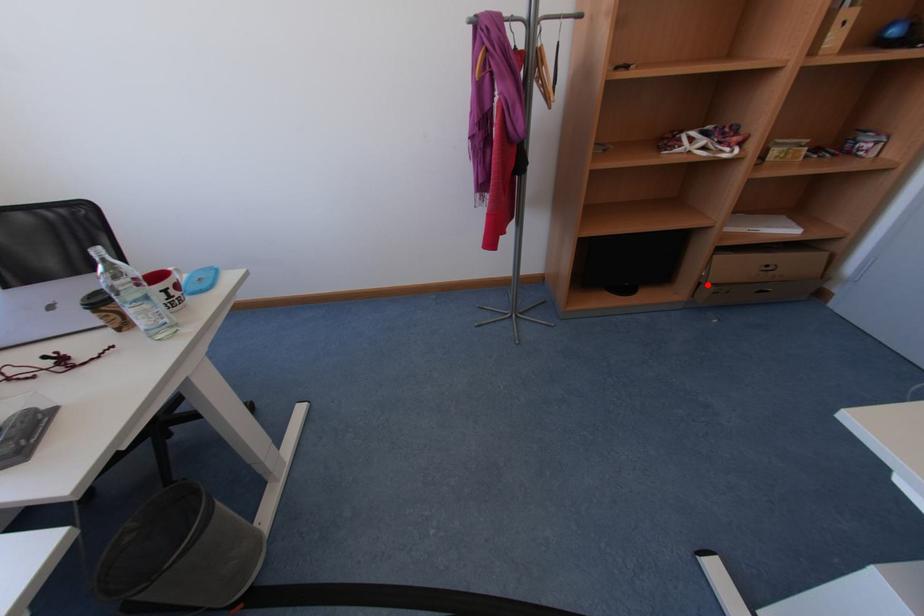
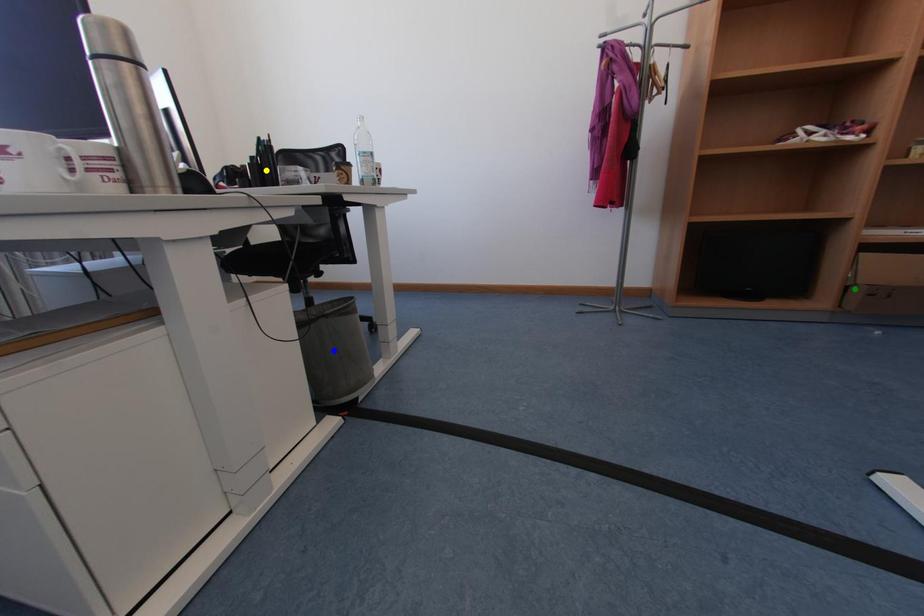
Question: I am providing you with two images of the same scene from different viewpoints. A red point is marked on the first image. You are given multiple points on the second image. Which point in image 2 is actually the same real-world point as the red point in image 1?

Choices:
 (A) yellow point
 (B) blue point
 (C) green point

Answer: (C)